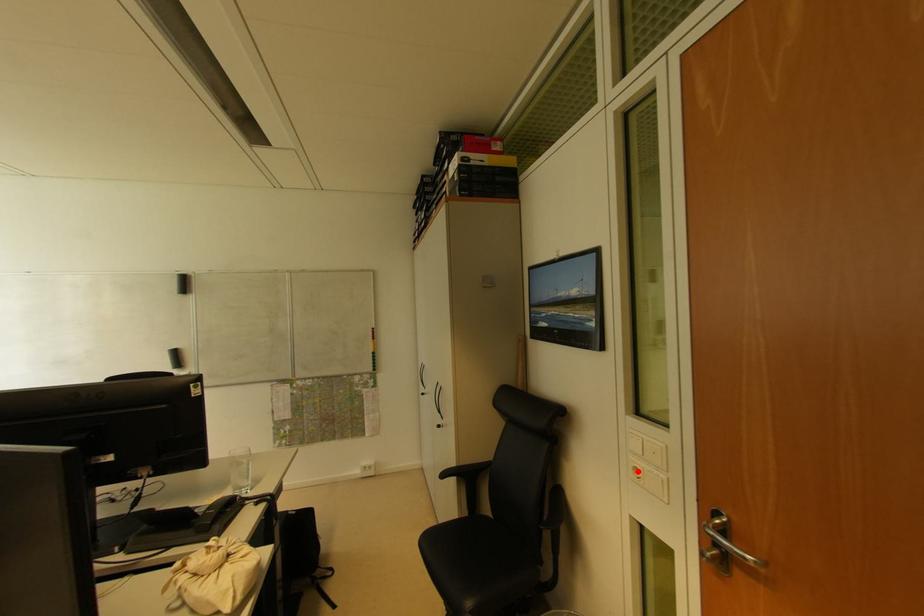
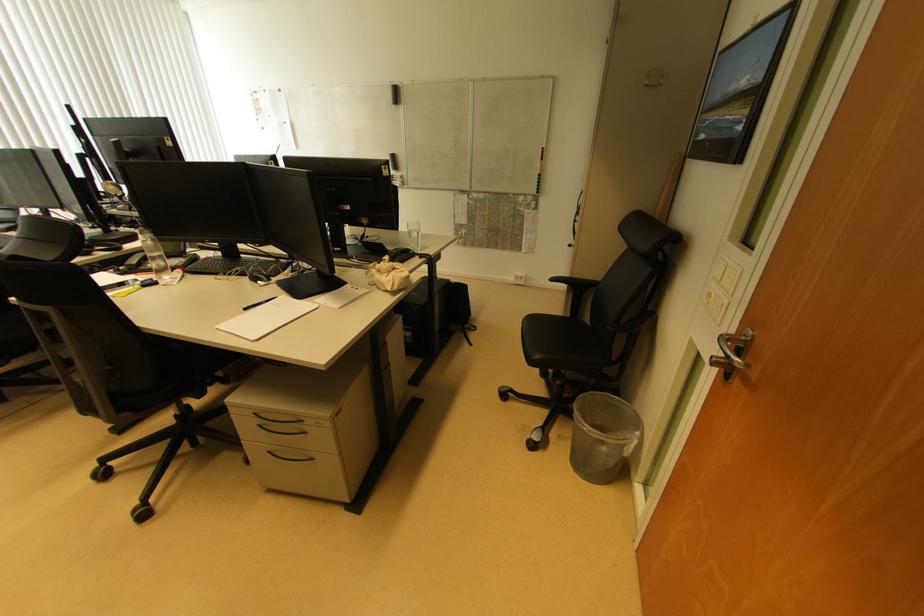
Find the pixel in the second image that matches the highlighted location in the first image.

(712, 297)